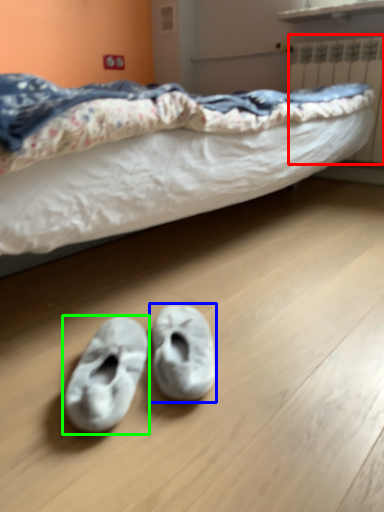
Question: Which is farther away from radiator (highlighted by a red box)? footwear (highlighted by a blue box) or footwear (highlighted by a green box)?

Choices:
 (A) footwear
 (B) footwear

Answer: (B)